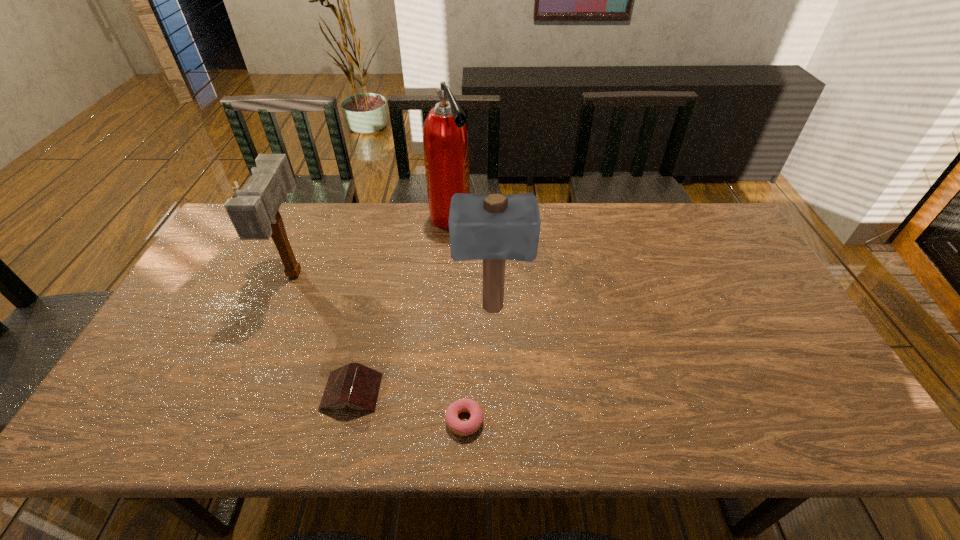
At what (x,y) coordinates should I click in order to perform the action: click on vacant point located between the farthest object and the leftmost object. Please return your answer as a coordinate pair (x, y). The width and height of the screenshot is (960, 540). Looking at the image, I should click on (372, 246).

Locate which object ranks in proximity to the shortest object. Please provide its 2D coordinates. Your answer should be formatted as a tuple, i.e. [(x, y)], where the tuple contains the x and y coordinates of a point satisfying the conditions above.

[(354, 384)]

Identify the location of object that is the second nearest to the right mallet. The height and width of the screenshot is (540, 960). (463, 428).

Image resolution: width=960 pixels, height=540 pixels. In order to click on free region that satisfies the following two spatial constraints: 1. on the front side of the left mallet; 2. on the left side of the doughnut in this screenshot , I will do [x=232, y=421].

Identify the location of vacant space that satisfies the following two spatial constraints: 1. on the front side of the tallest object; 2. on the left side of the right mallet. (443, 309).

At what (x,y) coordinates should I click in order to perform the action: click on vacant position in the image that satisfies the following two spatial constraints: 1. on the front side of the tallest object; 2. on the left side of the right mallet. Please return your answer as a coordinate pair (x, y). Looking at the image, I should click on (443, 309).